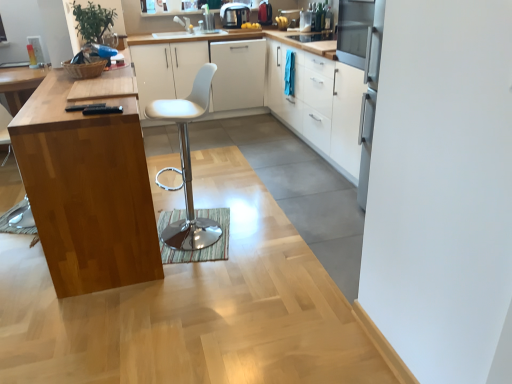
Question: Is the depth of white glossy cabinet at center, arranged as the second cabinetry when viewed from the right, greater than that of white matte cabinet at center, marked as the 1th cabinetry in a left-to-right arrangement?

Choices:
 (A) no
 (B) yes

Answer: (A)

Question: From the image's perspective, is white glossy cabinet at center, arranged as the second cabinetry when viewed from the right, below white matte cabinet at center, marked as the 1th cabinetry in a left-to-right arrangement?

Choices:
 (A) yes
 (B) no

Answer: (A)

Question: Is white glossy cabinet at center, arranged as the second cabinetry when viewed from the right, smaller than white matte cabinet at center, marked as the 1th cabinetry in a left-to-right arrangement?

Choices:
 (A) yes
 (B) no

Answer: (B)

Question: From a real-world perspective, is white glossy cabinet at center, arranged as the second cabinetry when viewed from the right, located beneath white matte cabinet at center, the 4th cabinetry viewed from the right?

Choices:
 (A) no
 (B) yes

Answer: (B)

Question: Is white glossy cabinet at center, arranged as the second cabinetry when viewed from the right, surrounding white matte cabinet at center, marked as the 1th cabinetry in a left-to-right arrangement?

Choices:
 (A) no
 (B) yes

Answer: (B)

Question: From the image's perspective, is white glossy cabinet at center, arranged as the second cabinetry when viewed from the right, above white matte cabinet at center, marked as the 1th cabinetry in a left-to-right arrangement?

Choices:
 (A) yes
 (B) no

Answer: (B)

Question: Does metallic silver toaster at upper center, the 1th appliance in the right-to-left sequence, appear on the left side of wooden cutting board at left?

Choices:
 (A) yes
 (B) no

Answer: (B)

Question: From a real-world perspective, is metallic silver toaster at upper center, the 1th appliance in the right-to-left sequence, on wooden cutting board at left?

Choices:
 (A) no
 (B) yes

Answer: (B)

Question: Does metallic silver toaster at upper center, positioned as the 2th appliance in left-to-right order, have a larger size compared to wooden cutting board at left?

Choices:
 (A) yes
 (B) no

Answer: (B)

Question: Is metallic silver toaster at upper center, the 1th appliance in the right-to-left sequence, at the right side of wooden cutting board at left?

Choices:
 (A) yes
 (B) no

Answer: (A)

Question: Does metallic silver toaster at upper center, the 1th appliance in the right-to-left sequence, have a smaller size compared to wooden cutting board at left?

Choices:
 (A) yes
 (B) no

Answer: (A)

Question: Could you tell me if metallic silver toaster at upper center, the 1th appliance in the right-to-left sequence, is turned towards wooden cutting board at left?

Choices:
 (A) no
 (B) yes

Answer: (A)

Question: Considering the relative positions of white matte cabinet at center, which ranks as the third cabinetry in right-to-left order, and wooden cutting board at left in the image provided, is white matte cabinet at center, which ranks as the third cabinetry in right-to-left order, behind wooden cutting board at left?

Choices:
 (A) yes
 (B) no

Answer: (A)